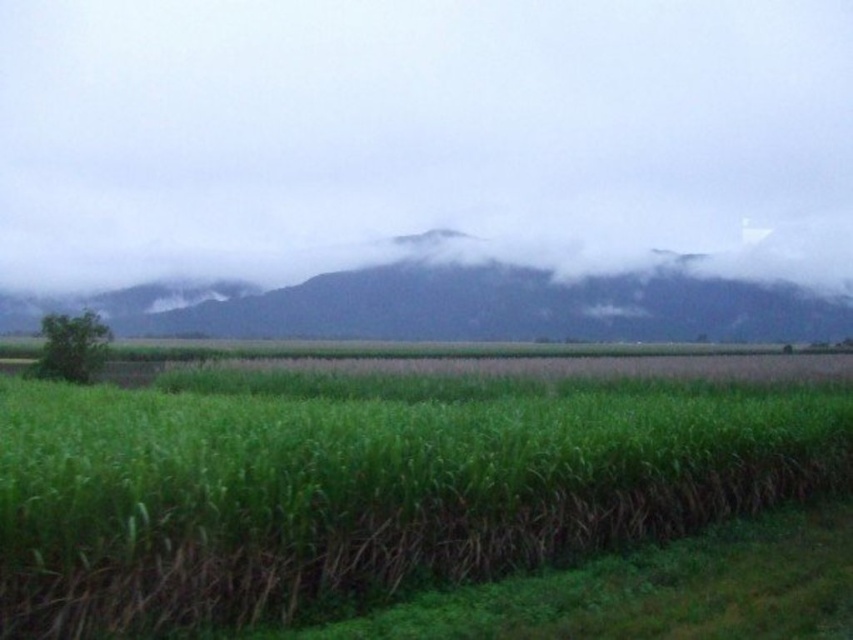
Does green grassy corn field at center appear on the left side of green grassy field at upper center?

No, green grassy corn field at center is not to the left of green grassy field at upper center.

Between point (375, 596) and point (461, 317), which one is positioned behind?

The point (461, 317) is more distant.

You are a GUI agent. You are given a task and a screenshot of the screen. Output one action in this format:
    pyautogui.click(x=<x>, y=<y>)
    Task: Click on the green grassy corn field at center
    This screenshot has height=640, width=853.
    Given the screenshot: What is the action you would take?
    pyautogui.click(x=380, y=480)